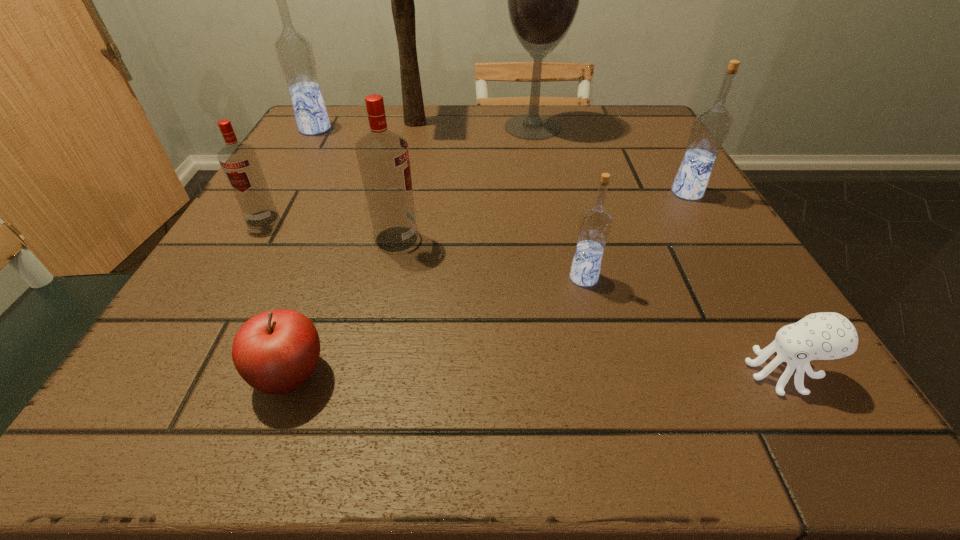
At what (x,y) coordinates should I click in order to perform the action: click on mallet. Please return your answer as a coordinate pair (x, y). Looking at the image, I should click on (402, 0).

Find the location of a particular element. The height and width of the screenshot is (540, 960). red alcohol is located at coordinates click(x=542, y=0).

This screenshot has height=540, width=960. Identify the location of the tallest vodka. (294, 51).

Where is `the third tallest object`? the third tallest object is located at coordinates (294, 51).

This screenshot has width=960, height=540. I want to click on the bigger red vodka, so click(x=383, y=156).

Locate an element on the screen. the right red vodka is located at coordinates (383, 156).

Locate an element on the screen. the second farthest blue vodka is located at coordinates (711, 126).

The width and height of the screenshot is (960, 540). Find the location of `the rightmost vodka`. the rightmost vodka is located at coordinates (711, 126).

The height and width of the screenshot is (540, 960). In order to click on the left red vodka in this screenshot , I will do `click(239, 161)`.

Where is `the nearest blue vodka`? the nearest blue vodka is located at coordinates (595, 224).